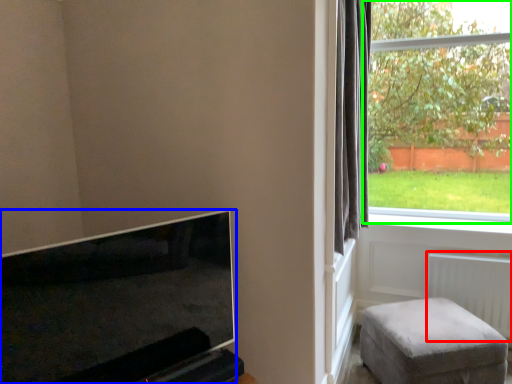
Question: Which object is the farthest from radiator (highlighted by a red box)? Choose among these: television (highlighted by a blue box) or window (highlighted by a green box).

Choices:
 (A) television
 (B) window

Answer: (B)